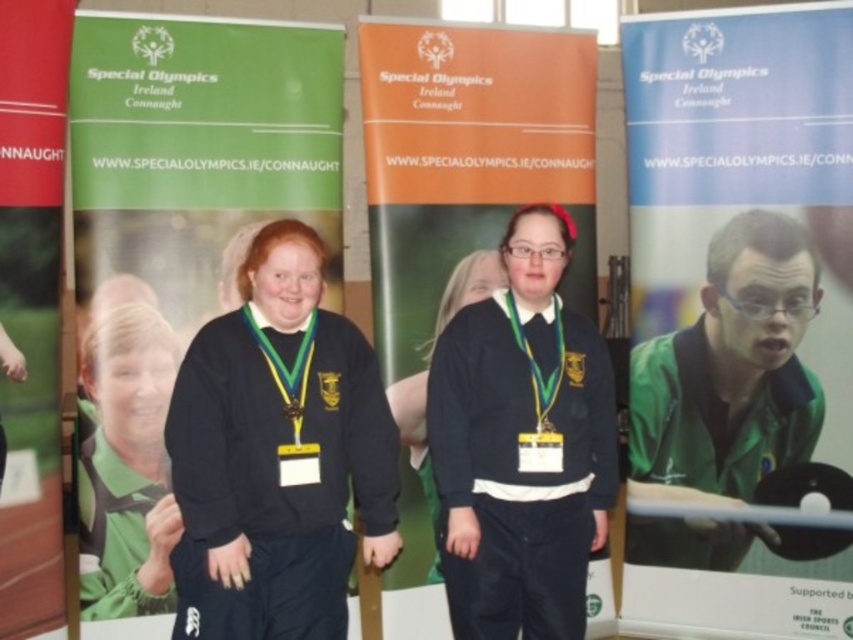
Question: Is green fabric shirt at center below gold metallic medal at center?

Choices:
 (A) no
 (B) yes

Answer: (B)

Question: Among these objects, which one is nearest to the camera?

Choices:
 (A) black matte sweatshirt at center
 (B) orange fabric banner at center
 (C) green matte poster at center

Answer: (A)

Question: Can you confirm if orange fabric banner at center is wider than green fabric shirt at center?

Choices:
 (A) no
 (B) yes

Answer: (B)

Question: Which point is farther from the camera taking this photo?

Choices:
 (A) (33, 513)
 (B) (306, 29)
 (C) (328, 454)

Answer: (B)

Question: Considering the relative positions of orange fabric banner at center and gold shiny medal at center in the image provided, where is orange fabric banner at center located with respect to gold shiny medal at center?

Choices:
 (A) below
 (B) above

Answer: (B)

Question: Which is nearer to the green matte poster at center?

Choices:
 (A) black matte sweatshirt at center
 (B) matte black sweater at center
 (C) green fabric shirt at center

Answer: (C)